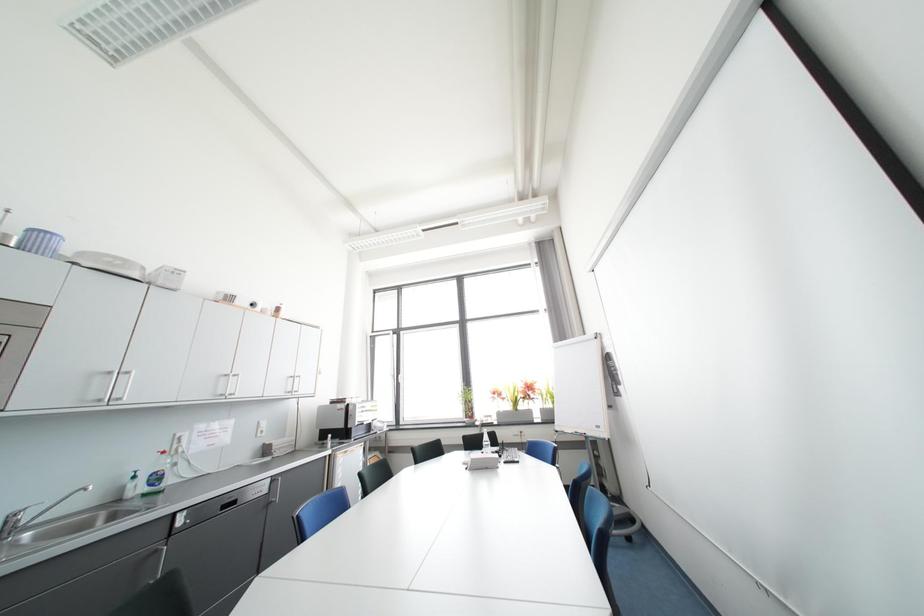
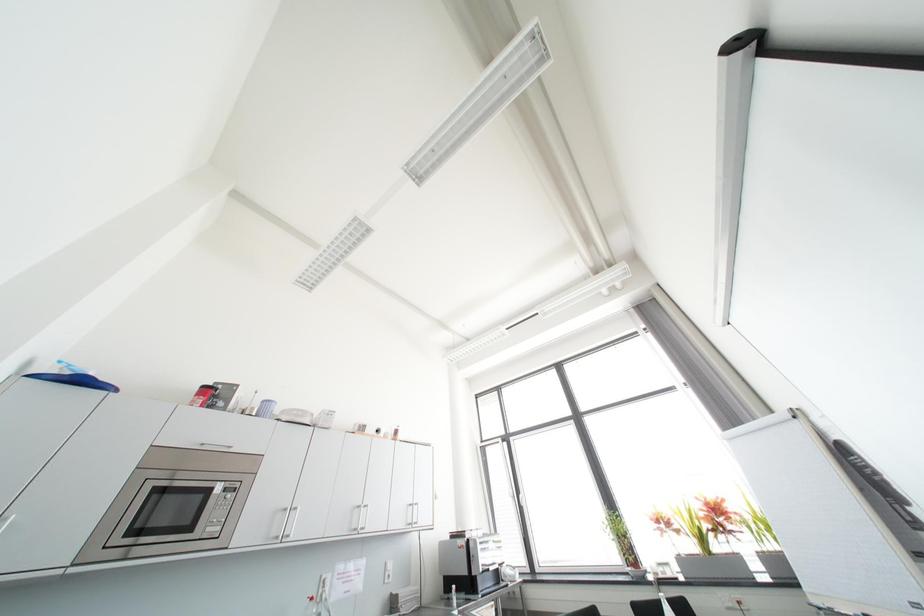
Based on the continuous images, in which direction is the camera rotating?

The camera rotated toward left-up.